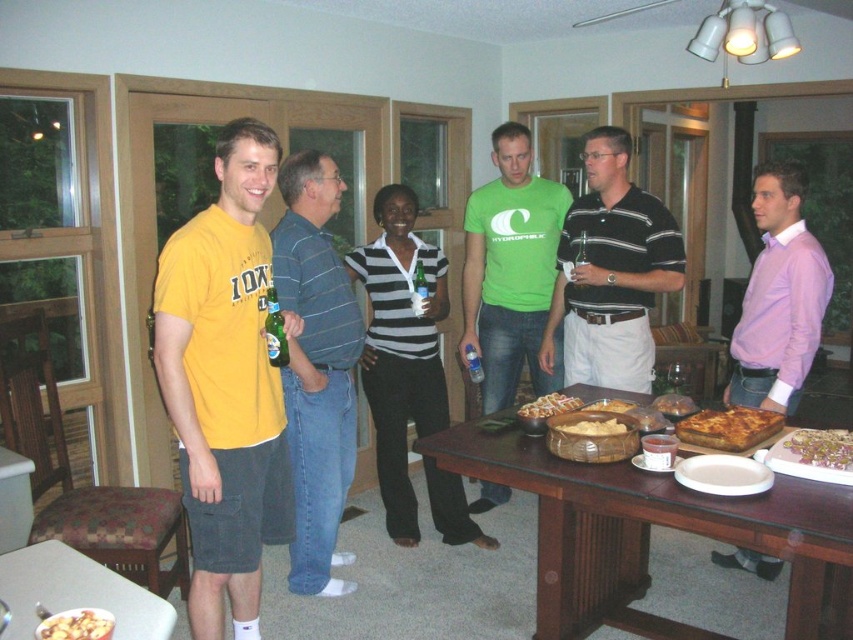
This screenshot has width=853, height=640. What do you see at coordinates (316, 368) in the screenshot?
I see `yellow t-shirt at left` at bounding box center [316, 368].

Which of these two, yellow t-shirt at left or golden brown flaky pie at center, stands shorter?

golden brown flaky pie at center is shorter.

Where is `yellow t-shirt at left`? yellow t-shirt at left is located at coordinates (316, 368).

The image size is (853, 640). What do you see at coordinates (822, 448) in the screenshot? I see `golden brown flaky pie at center` at bounding box center [822, 448].

In the scene shown: Is golden brown flaky pie at center wider than green glass bottle at center?

Yes, golden brown flaky pie at center is wider than green glass bottle at center.

The width and height of the screenshot is (853, 640). I want to click on golden brown flaky pie at center, so click(x=822, y=448).

The height and width of the screenshot is (640, 853). In order to click on golden brown flaky pie at center in this screenshot , I will do `click(822, 448)`.

Can you confirm if brown wooden table at center is smaller than golden brown crusty bread at table center?

No.

Image resolution: width=853 pixels, height=640 pixels. Describe the element at coordinates (648, 532) in the screenshot. I see `brown wooden table at center` at that location.

Where is `brown wooden table at center`? Image resolution: width=853 pixels, height=640 pixels. brown wooden table at center is located at coordinates (648, 532).